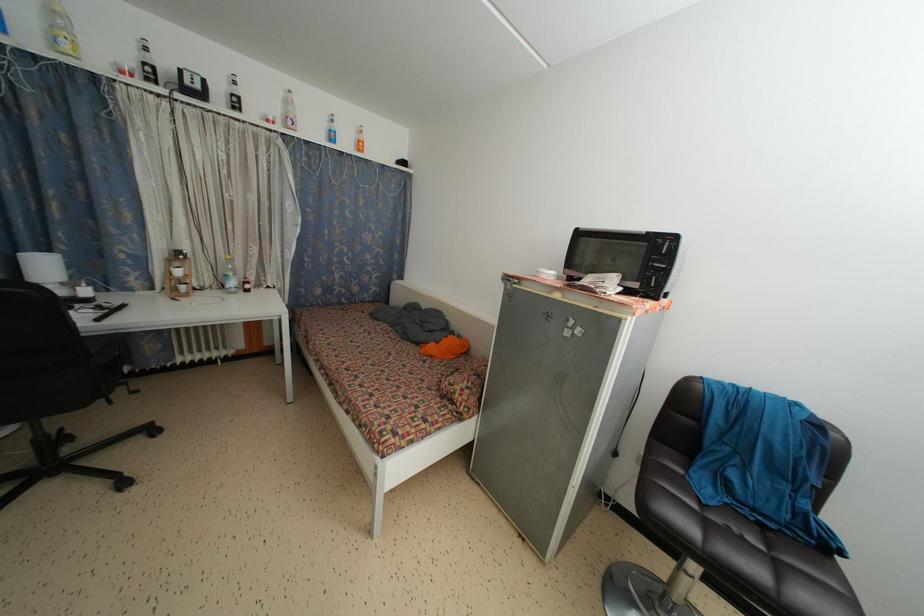
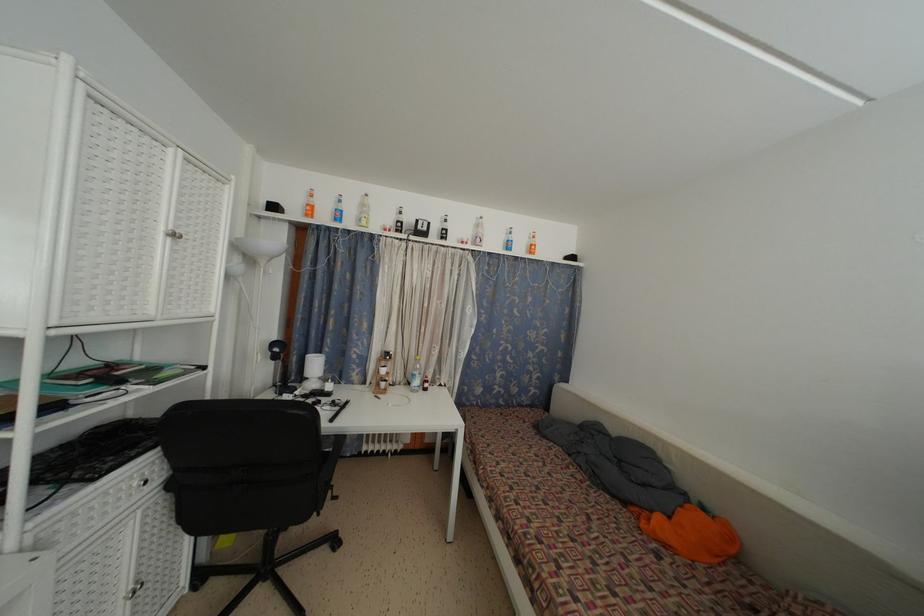
The images are taken continuously from a first-person perspective. In which direction is your viewpoint rotating?

The rotation direction of the camera is left-up.